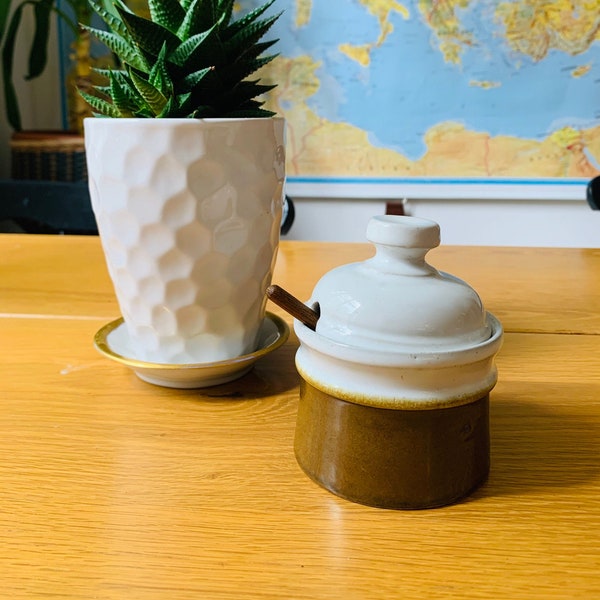
The image size is (600, 600). Identify the location of plant. (210, 62).